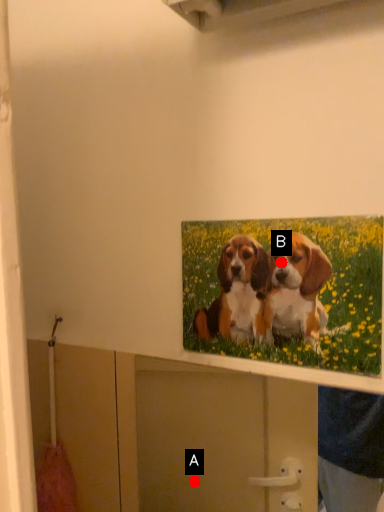
Question: Two points are circled on the image, labeled by A and B beside each circle. Which point is further to the camera?

Choices:
 (A) A is further
 (B) B is further

Answer: (A)